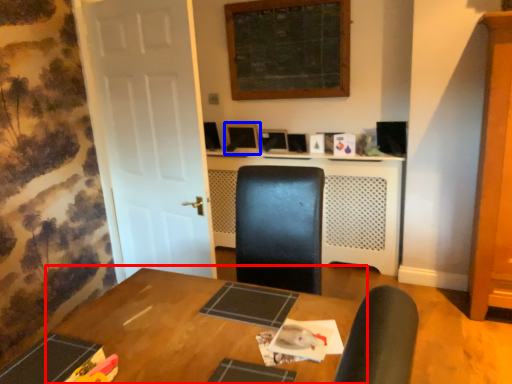
Question: Which object appears farthest to the camera in this image, table (highlighted by a red box) or computer monitor (highlighted by a blue box)?

Choices:
 (A) table
 (B) computer monitor

Answer: (B)